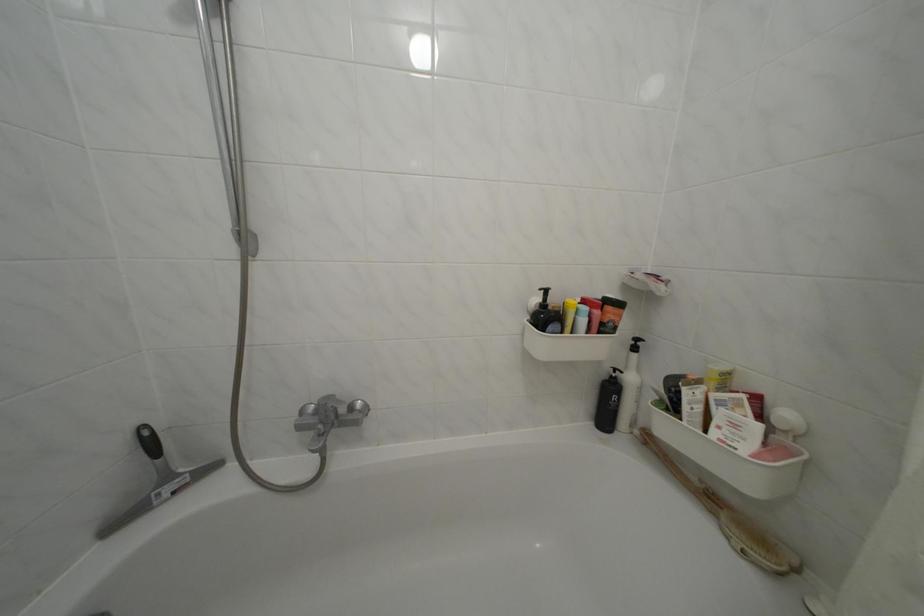
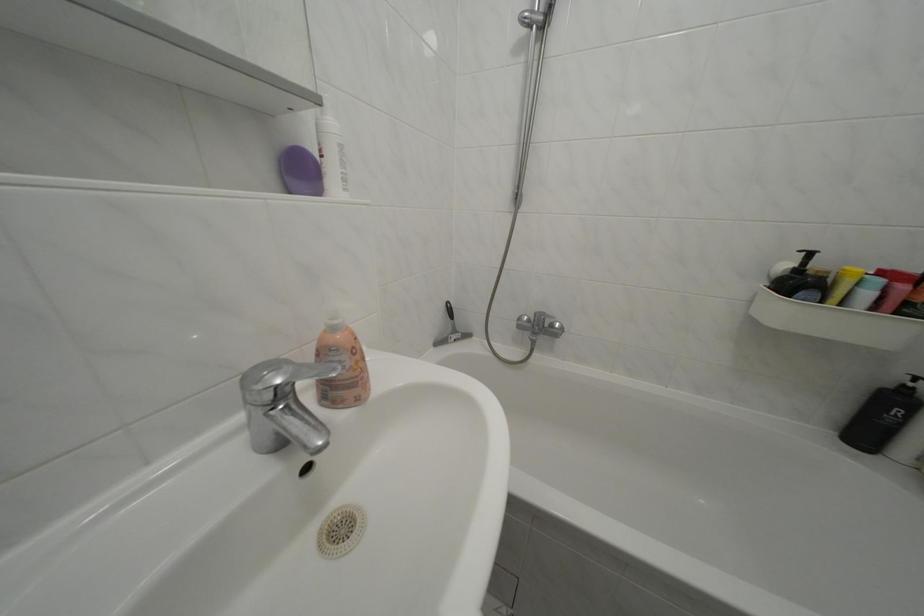
The point at (567, 318) is marked in the first image. Where is the corresponding point in the second image?

(833, 285)